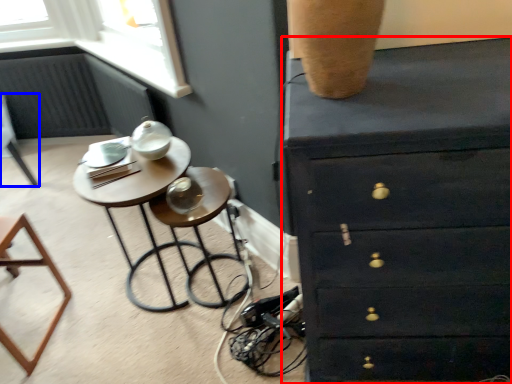
Question: Among these objects, which one is nearest to the camera, chest of drawers (highlighted by a red box) or furniture (highlighted by a blue box)?

Choices:
 (A) chest of drawers
 (B) furniture

Answer: (A)